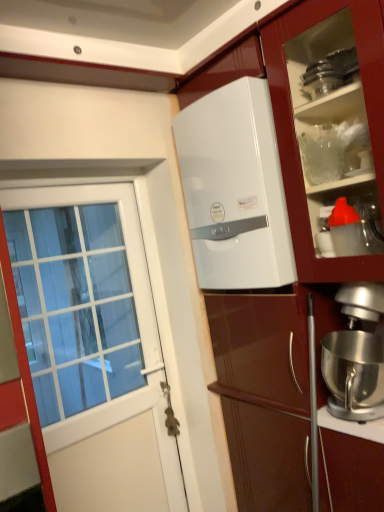
Question: Does metallic silver door handle at lower center have a lesser height compared to silver metallic stand mixer at lower right?

Choices:
 (A) no
 (B) yes

Answer: (B)

Question: Is metallic silver door handle at lower center facing towards silver metallic stand mixer at lower right?

Choices:
 (A) no
 (B) yes

Answer: (A)

Question: From the image's perspective, is metallic silver door handle at lower center located above silver metallic stand mixer at lower right?

Choices:
 (A) yes
 (B) no

Answer: (B)

Question: Is silver metallic stand mixer at lower right surrounded by metallic silver door handle at lower center?

Choices:
 (A) yes
 (B) no

Answer: (B)

Question: From a real-world perspective, is metallic silver door handle at lower center positioned under silver metallic stand mixer at lower right based on gravity?

Choices:
 (A) no
 (B) yes

Answer: (B)

Question: Does metallic silver door handle at lower center have a greater height compared to silver metallic stand mixer at lower right?

Choices:
 (A) no
 (B) yes

Answer: (A)

Question: Considering the relative sizes of white glossy refrigerator at center and white glossy water heater at upper center in the image provided, is white glossy refrigerator at center bigger than white glossy water heater at upper center?

Choices:
 (A) yes
 (B) no

Answer: (A)

Question: Does white glossy refrigerator at center appear on the right side of white glossy water heater at upper center?

Choices:
 (A) yes
 (B) no

Answer: (A)

Question: From a real-world perspective, does white glossy refrigerator at center sit lower than white glossy water heater at upper center?

Choices:
 (A) yes
 (B) no

Answer: (A)

Question: Can you confirm if white glossy refrigerator at center is shorter than white glossy water heater at upper center?

Choices:
 (A) no
 (B) yes

Answer: (A)

Question: From the image's perspective, is white glossy refrigerator at center located beneath white glossy water heater at upper center?

Choices:
 (A) no
 (B) yes

Answer: (B)

Question: Is white glossy refrigerator at center positioned before white glossy water heater at upper center?

Choices:
 (A) yes
 (B) no

Answer: (A)

Question: From the image's perspective, is metallic silver door handle at lower center above white glossy door at left?

Choices:
 (A) no
 (B) yes

Answer: (A)